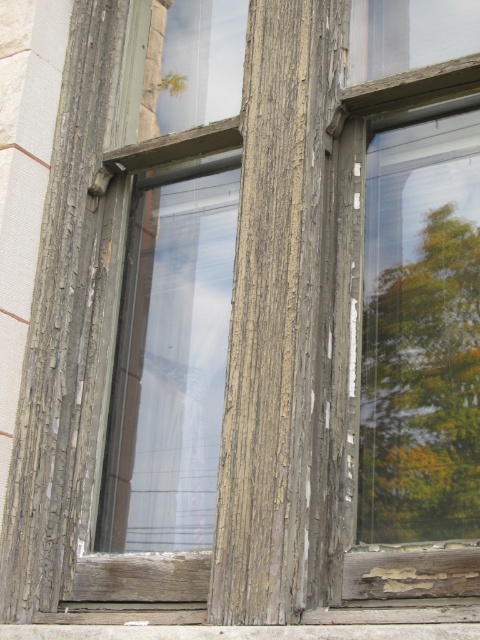
You are standing in front of the weathered wooden window frame. There are two points marked on the window glass at coordinates point [434,284] and point [46,625]. Which point is nearer to your eyes?

Point [434,284] is closer to the camera than point [46,625].

You are an architect assessing the structural integrity of the wooden plank at lower center and the green leafy tree at right. Which object appears larger in the image?

The wooden plank at lower center appears larger than the green leafy tree at right in the image.

You are standing in front of the wooden window frame and notice the green leafy tree at right and the wooden plank at lower center. Which object appears taller in the reflection?

The green leafy tree at right appears taller than the wooden plank at lower center in the reflection, as it has a greater height compared to the wooden plank at lower center.